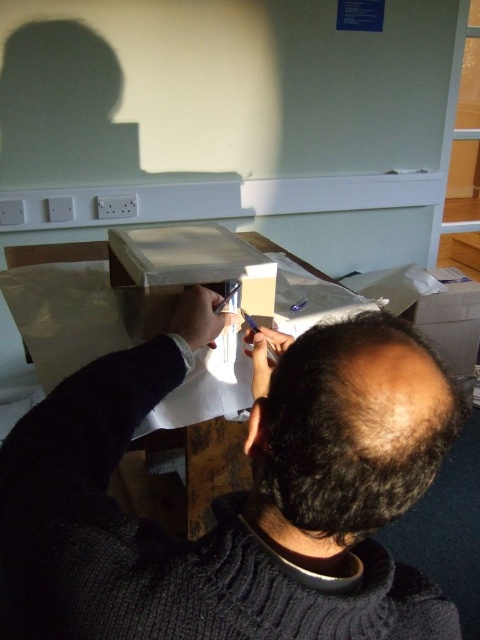
Question: Does dark gray sweater at center lie behind cardboard box at upper right?

Choices:
 (A) yes
 (B) no

Answer: (B)

Question: Observing the image, what is the correct spatial positioning of dark gray sweater at center in reference to matte white box at center?

Choices:
 (A) right
 (B) left

Answer: (A)

Question: Can you confirm if matte white box at center is thinner than cardboard box at upper right?

Choices:
 (A) no
 (B) yes

Answer: (B)

Question: Which point is closer to the camera taking this photo?

Choices:
 (A) (471, 298)
 (B) (170, 228)
 (C) (304, 618)

Answer: (C)

Question: Which of these objects is positioned closest to the matte white box at center?

Choices:
 (A) cardboard box at upper right
 (B) dark gray sweater at center

Answer: (B)

Question: Which point is farther from the camera taking this photo?

Choices:
 (A) (79, 410)
 (B) (159, 298)

Answer: (B)